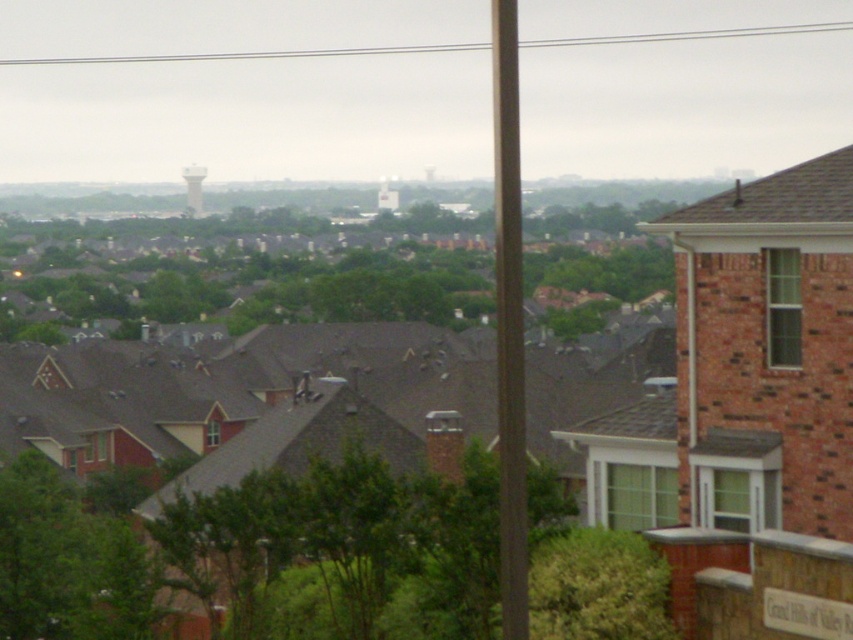
Is point (503, 589) closer to viewer compared to point (392, 188)?

Yes, point (503, 589) is in front of point (392, 188).

Who is shorter, brown wood pole at center or white concrete water tower at center?

With less height is white concrete water tower at center.

Is point (506, 180) less distant than point (386, 193)?

That is True.

This screenshot has width=853, height=640. What are the coordinates of `brown wood pole at center` in the screenshot? It's located at (509, 321).

Does white matte water tower at upper left appear on the left side of white concrete water tower at center?

Yes, white matte water tower at upper left is to the left of white concrete water tower at center.

Does white matte water tower at upper left have a greater height compared to white concrete water tower at center?

Correct, white matte water tower at upper left is much taller as white concrete water tower at center.

Does point (198, 188) lie in front of point (387, 182)?

Yes, point (198, 188) is closer to viewer.

You are a GUI agent. You are given a task and a screenshot of the screen. Output one action in this format:
    pyautogui.click(x=<x>, y=<y>)
    Task: Click on the white matte water tower at upper left
    This screenshot has width=853, height=640.
    Given the screenshot: What is the action you would take?
    pyautogui.click(x=194, y=188)

Who is more distant from viewer, (x=498, y=406) or (x=198, y=216)?

The point (x=198, y=216) is more distant.

Is point (524, 486) closer to camera compared to point (190, 200)?

Yes, it is.

The width and height of the screenshot is (853, 640). In order to click on brown wood pole at center in this screenshot , I will do `click(509, 321)`.